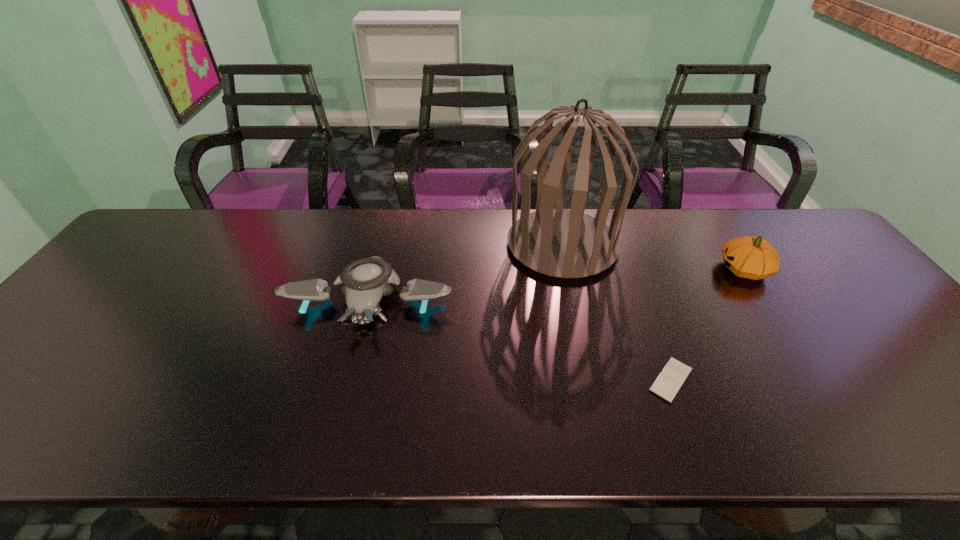
Identify the location of vacant area located 0.200m on the side of the rightmost object with the carved face. The width and height of the screenshot is (960, 540). (648, 269).

The height and width of the screenshot is (540, 960). I want to click on vacant space positioned 0.090m on the front-facing side of the leftmost object, so click(351, 370).

Find the location of a particular element. vacant area situated on the back of the shortest object is located at coordinates (648, 319).

Identify the location of birdcage present at the far edge. (561, 243).

Find the location of a particular element. The image size is (960, 540). gourd that is positioned at the far edge is located at coordinates tap(750, 257).

At what (x,y) coordinates should I click in order to perform the action: click on vacant space at the far edge. Please return your answer as a coordinate pair (x, y). Looking at the image, I should click on pyautogui.click(x=299, y=254).

In the image, there is a desktop. In order to click on vacant space at the near edge in this screenshot , I will do `click(270, 411)`.

In the image, there is a desktop. At what (x,y) coordinates should I click in order to perform the action: click on vacant space at the left edge. Please return your answer as a coordinate pair (x, y). Looking at the image, I should click on (163, 265).

This screenshot has height=540, width=960. Find the location of `vacant space at the right edge of the desktop`. vacant space at the right edge of the desktop is located at coordinates (833, 284).

Where is `free region at the far left corner of the desktop`? free region at the far left corner of the desktop is located at coordinates (152, 248).